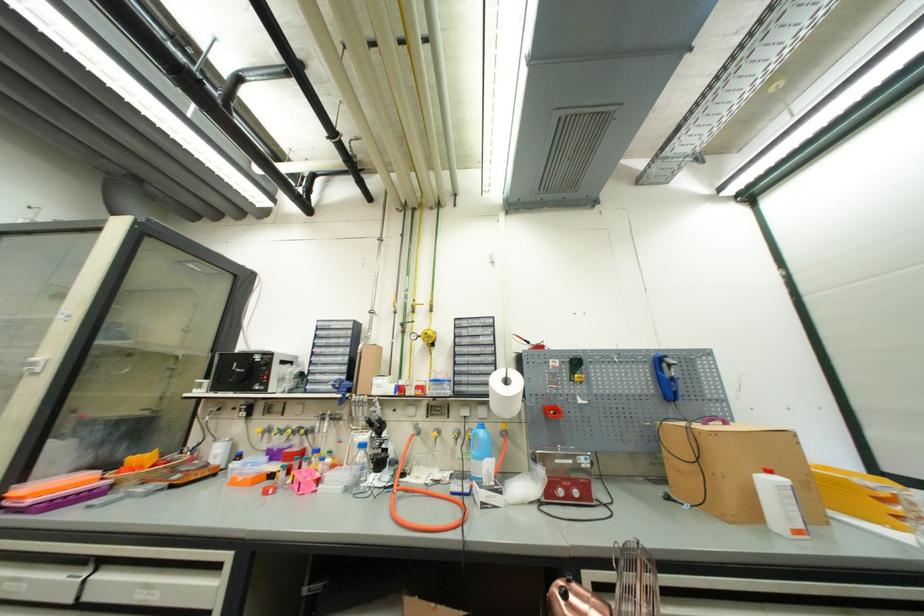
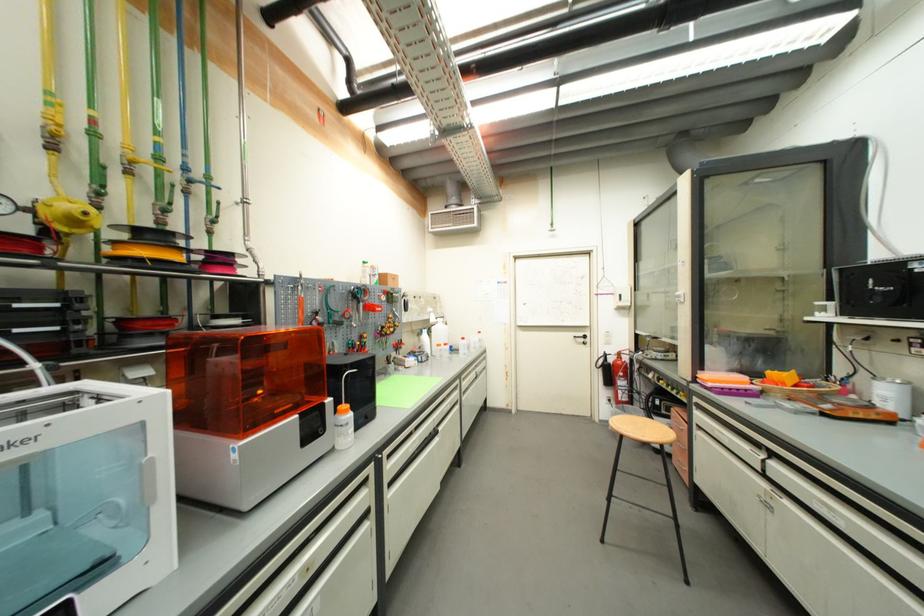
Find the pixel in the second image that matches point (116, 476) in the first image.

(761, 383)